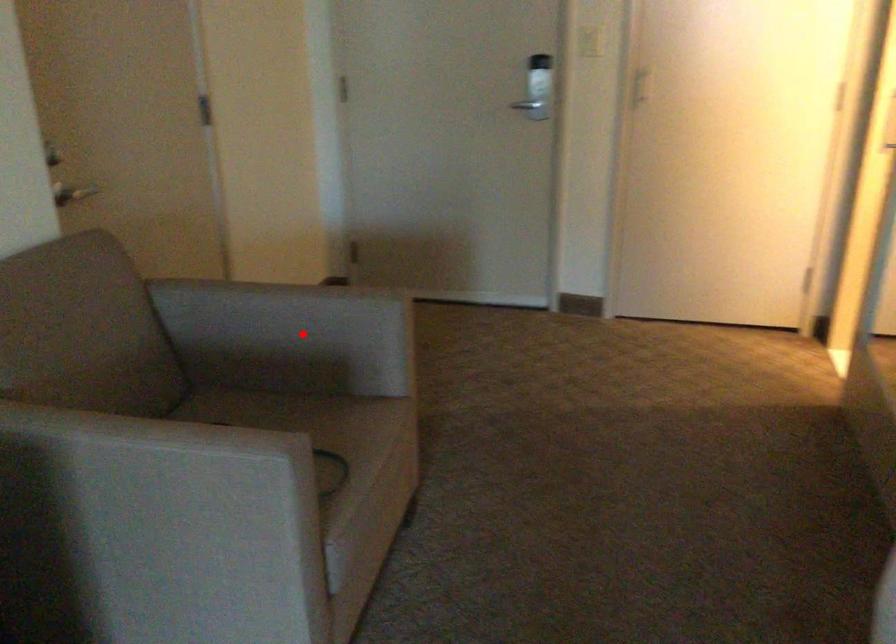
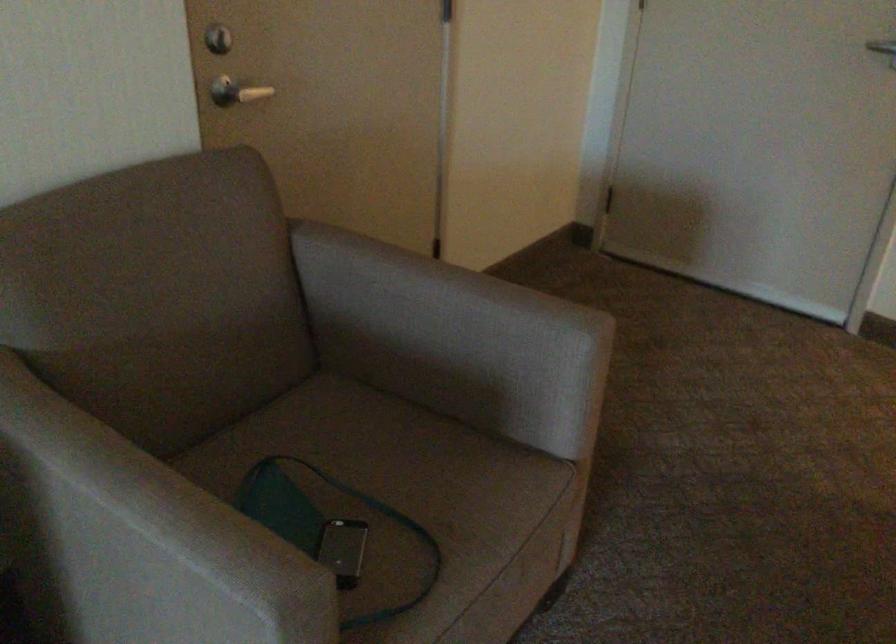
Locate, in the second image, the point that corresponds to the highlighted location in the first image.

(453, 339)